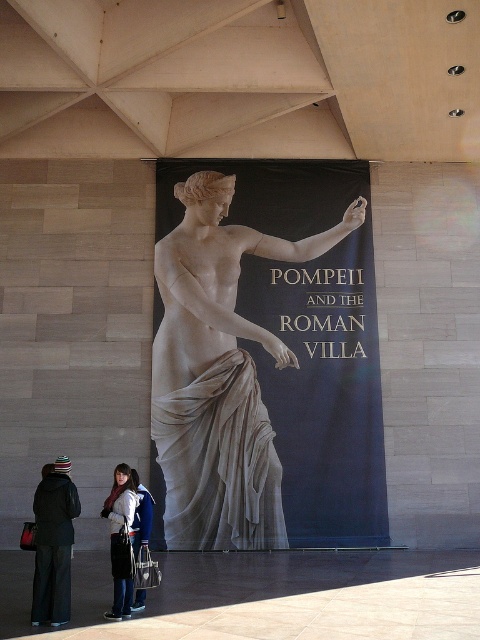
You are standing in the museum and want to take a photo of the banner without any obstruction. There is a black woolen jacket at lower left in the scene. Based on its position, will the jacket block your view of the banner?

The black woolen jacket at lower left is located at point (54, 544), which is near the lower edge of the scene. Since the banner is displayed on the wall and the jacket is positioned at the lower left corner, it is unlikely to obstruct the view of the banner unless you are crouching very low. Therefore, the jacket should not block your view of the banner.